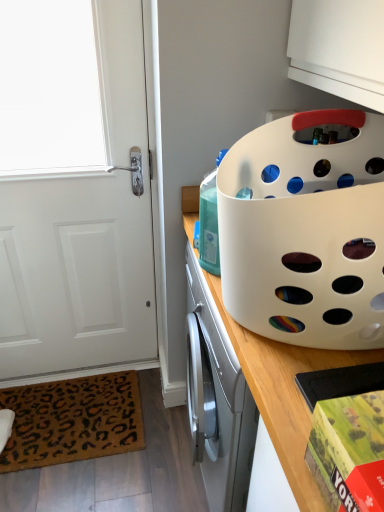
Question: Considering the relative sizes of brown leopard print mat at lower left and white matte door at left in the image provided, is brown leopard print mat at lower left smaller than white matte door at left?

Choices:
 (A) no
 (B) yes

Answer: (B)

Question: Does brown leopard print mat at lower left appear on the right side of white matte door at left?

Choices:
 (A) yes
 (B) no

Answer: (B)

Question: Does brown leopard print mat at lower left touch white matte door at left?

Choices:
 (A) no
 (B) yes

Answer: (A)

Question: Is brown leopard print mat at lower left looking in the opposite direction of white matte door at left?

Choices:
 (A) no
 (B) yes

Answer: (A)

Question: From a real-world perspective, is brown leopard print mat at lower left positioned over white matte door at left based on gravity?

Choices:
 (A) no
 (B) yes

Answer: (A)

Question: In terms of width, does white matte door at left look wider or thinner when compared to translucent plastic bottle at center?

Choices:
 (A) thin
 (B) wide

Answer: (B)

Question: Is white matte door at left situated inside translucent plastic bottle at center or outside?

Choices:
 (A) inside
 (B) outside

Answer: (B)

Question: From the image's perspective, is white matte door at left located above or below translucent plastic bottle at center?

Choices:
 (A) above
 (B) below

Answer: (B)

Question: From a real-world perspective, is white matte door at left above or below translucent plastic bottle at center?

Choices:
 (A) below
 (B) above

Answer: (A)

Question: Is red matte board game box at lower right in front of or behind white plastic basket at upper right in the image?

Choices:
 (A) behind
 (B) front

Answer: (B)

Question: Is red matte board game box at lower right wider or thinner than white plastic basket at upper right?

Choices:
 (A) thin
 (B) wide

Answer: (A)

Question: In terms of height, does red matte board game box at lower right look taller or shorter compared to white plastic basket at upper right?

Choices:
 (A) tall
 (B) short

Answer: (B)

Question: Is red matte board game box at lower right bigger or smaller than white plastic basket at upper right?

Choices:
 (A) small
 (B) big

Answer: (A)

Question: Is translucent plastic bottle at center inside the boundaries of white matte door at left, or outside?

Choices:
 (A) inside
 (B) outside

Answer: (B)

Question: From a real-world perspective, is translucent plastic bottle at center positioned above or below white matte door at left?

Choices:
 (A) below
 (B) above

Answer: (B)